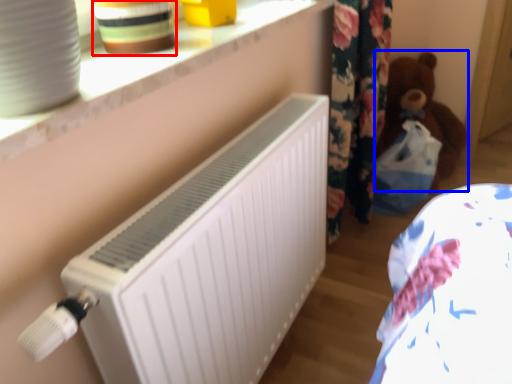
Question: Which object appears farthest to the camera in this image, pottery (highlighted by a red box) or teddy (highlighted by a blue box)?

Choices:
 (A) pottery
 (B) teddy

Answer: (B)